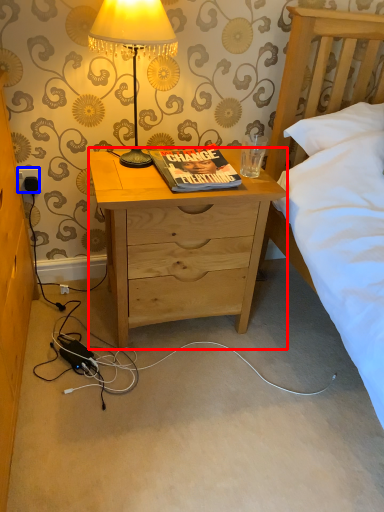
Question: Among these objects, which one is farthest to the camera, desk (highlighted by a red box) or power outlet (highlighted by a blue box)?

Choices:
 (A) desk
 (B) power outlet

Answer: (B)